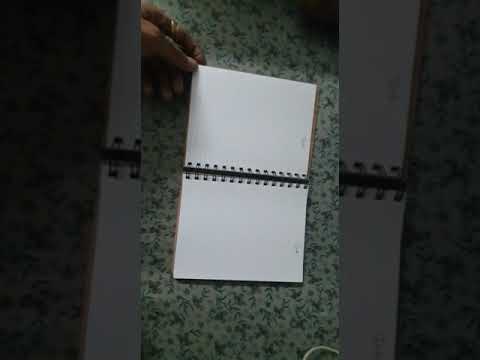
Locate an element on the screen. The height and width of the screenshot is (360, 480). floral blanket is located at coordinates tap(222, 326).